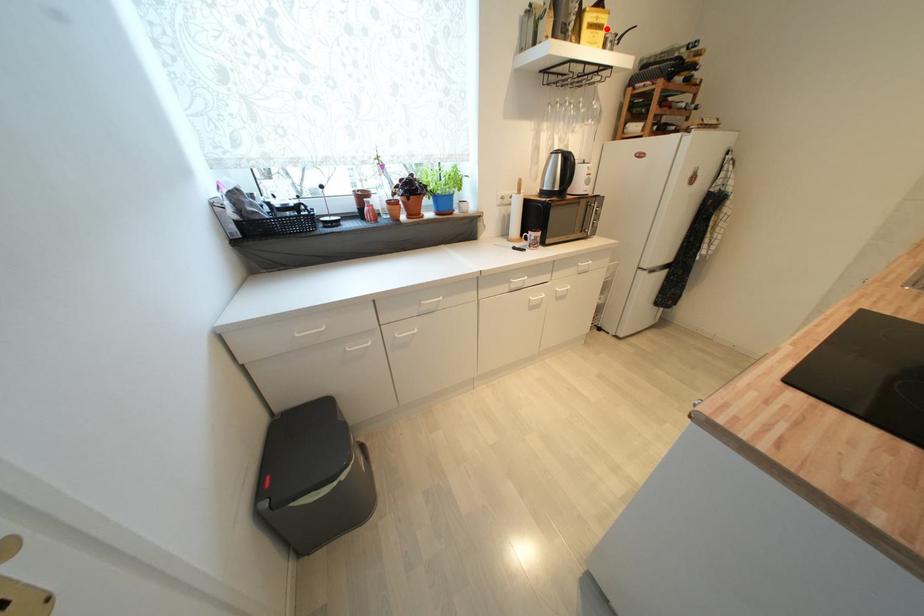
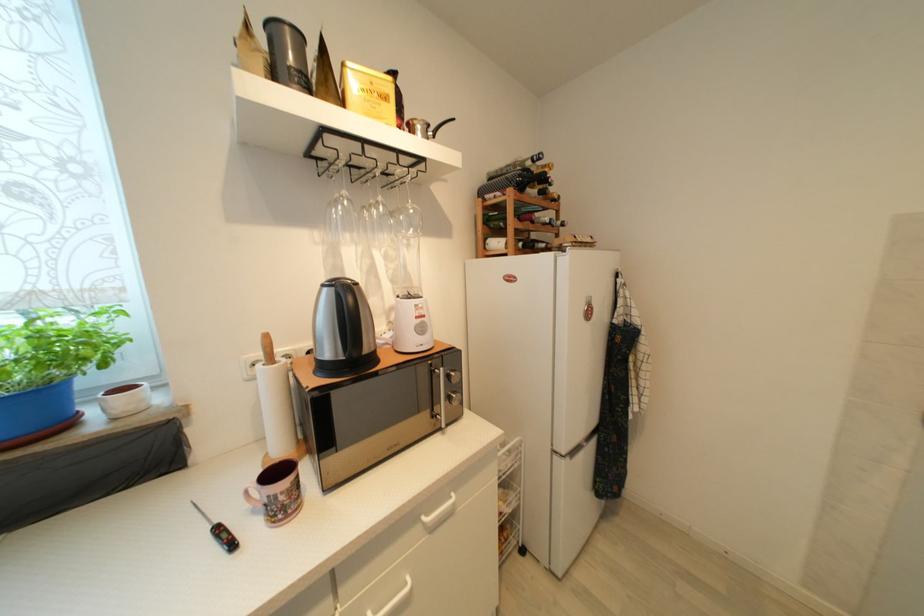
Where in the second image is the point corresponding to the highlighted location from the first image?

(391, 100)